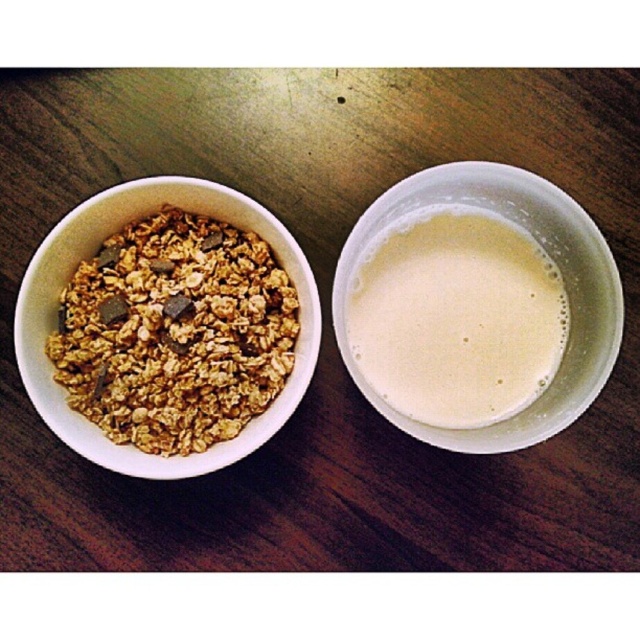
Who is more distant from viewer, (470, 328) or (228, 445)?

Point (470, 328)

This screenshot has height=640, width=640. Describe the element at coordinates (458, 321) in the screenshot. I see `white creamy liquid at right` at that location.

Identify the location of white creamy liquid at right. (458, 321).